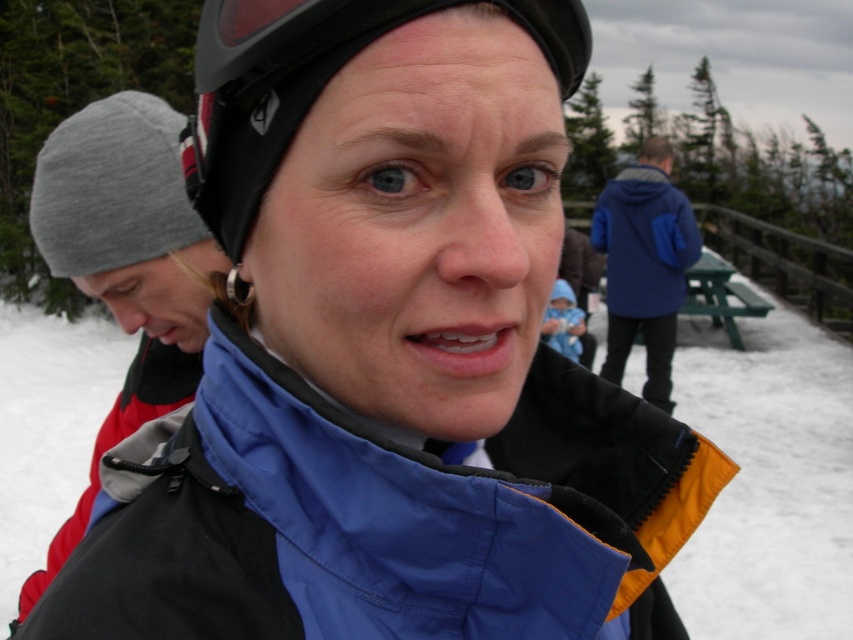
You are organizing a winter clothing display and need to arrange the gray knit beanie at left and the blue fleece jacket at right. Based on their sizes, which item should you place on the smaller shelf and which on the larger shelf?

The gray knit beanie at left occupies less space than the blue fleece jacket at right, so the gray knit beanie at left should be placed on the smaller shelf and the blue fleece jacket at right on the larger shelf.

You are a photographer trying to frame a shot of the blue fabric jacket at center and the gray knit beanie at left. Which object should you focus on first if you want to capture both in the same frame without moving the camera?

The blue fabric jacket at center is not as tall as the gray knit beanie at left, so you should focus on the gray knit beanie at left first to ensure both fit in the frame.